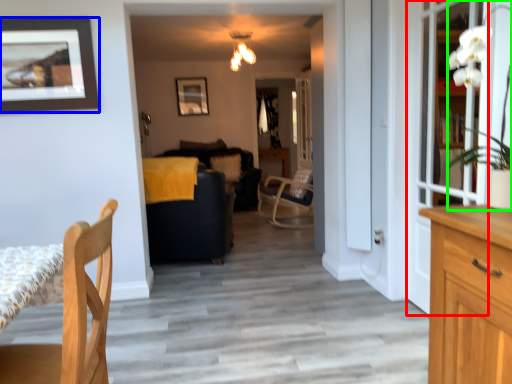
Question: Which object is the closest to the glass door (highlighted by a red box)? Choose among these: picture frame (highlighted by a blue box) or houseplant (highlighted by a green box).

Choices:
 (A) picture frame
 (B) houseplant

Answer: (B)